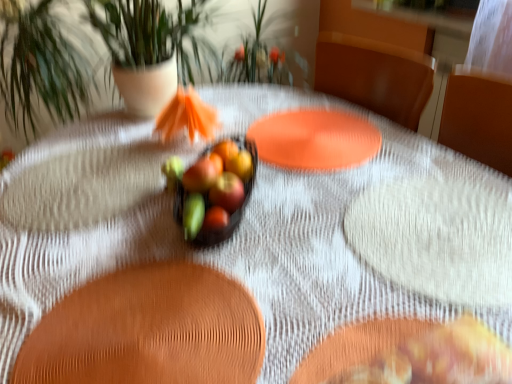
At what (x,y) coordinates should I click in order to perform the action: click on unoccupied region to the right of glossy ceramic grapefruit at center. Please return your answer as a coordinate pair (x, y). Looking at the image, I should click on (367, 226).